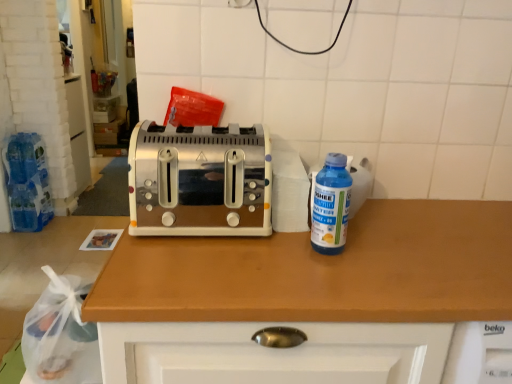
In order to click on vacant area that is in front of satin silver toaster at center in this screenshot , I will do `click(199, 268)`.